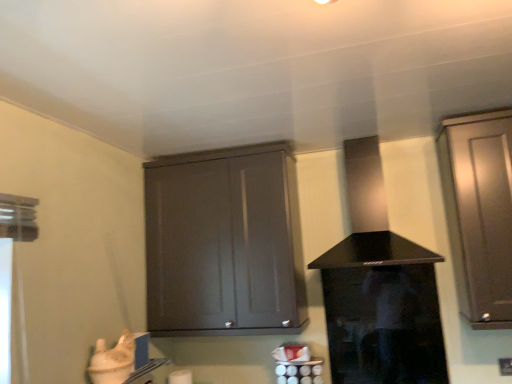
The width and height of the screenshot is (512, 384). In order to click on black glass vent at center in this screenshot , I will do `click(369, 217)`.

What do you see at coordinates (479, 212) in the screenshot?
I see `satin brown cabinet at right, the second cabinetry in the left-to-right sequence` at bounding box center [479, 212].

How much space does satin brown cabinet at right, the second cabinetry in the left-to-right sequence, occupy horizontally?

It is 37.26 centimeters.

Find the location of a particular element. This screenshot has height=384, width=512. matte gray cabinet at center, which appears as the first cabinetry when viewed from the left is located at coordinates pyautogui.click(x=223, y=242).

Find the location of a particular element. transparent glass screen door at center is located at coordinates 384,325.

What are the coordinates of `black glass vent at center` in the screenshot? It's located at (369, 217).

From a real-world perspective, is black glass vent at center positioned under matte gray cabinet at center, which appears as the first cabinetry when viewed from the left, based on gravity?

No, from a real-world perspective, black glass vent at center is not below matte gray cabinet at center, which appears as the first cabinetry when viewed from the left.

Can you confirm if black glass vent at center is positioned to the left of matte gray cabinet at center, the second cabinetry from the right?

In fact, black glass vent at center is to the right of matte gray cabinet at center, the second cabinetry from the right.

Which object is wider, black glass vent at center or matte gray cabinet at center, which appears as the first cabinetry when viewed from the left?

black glass vent at center is wider.

Could you measure the distance between black glass vent at center and matte gray cabinet at center, which appears as the first cabinetry when viewed from the left?

black glass vent at center and matte gray cabinet at center, which appears as the first cabinetry when viewed from the left, are 22.08 inches apart.

From a real-world perspective, is transparent glass screen door at center under satin brown cabinet at right, the second cabinetry in the left-to-right sequence?

Yes.

Looking at this image, looking at their sizes, would you say transparent glass screen door at center is wider or thinner than satin brown cabinet at right, the second cabinetry in the left-to-right sequence?

In the image, transparent glass screen door at center appears to be more narrow than satin brown cabinet at right, the second cabinetry in the left-to-right sequence.

Identify the location of screen door on the left of satin brown cabinet at right, the second cabinetry in the left-to-right sequence. (384, 325).

Would you say transparent glass screen door at center is outside satin brown cabinet at right, the second cabinetry in the left-to-right sequence?

transparent glass screen door at center is positioned outside satin brown cabinet at right, the second cabinetry in the left-to-right sequence.

Consider the image. Is satin brown cabinet at right, the second cabinetry in the left-to-right sequence, inside the boundaries of black glass vent at center, or outside?

satin brown cabinet at right, the second cabinetry in the left-to-right sequence, is located beyond the bounds of black glass vent at center.

Is satin brown cabinet at right, placed as the first cabinetry when sorted from right to left, placed right next to black glass vent at center?

There is a gap between satin brown cabinet at right, placed as the first cabinetry when sorted from right to left, and black glass vent at center.

Considering the sizes of objects satin brown cabinet at right, the second cabinetry in the left-to-right sequence, and black glass vent at center in the image provided, who is thinner, satin brown cabinet at right, the second cabinetry in the left-to-right sequence, or black glass vent at center?

Thinner between the two is satin brown cabinet at right, the second cabinetry in the left-to-right sequence.

From the image's perspective, is transparent glass screen door at center positioned above or below matte gray cabinet at center, the second cabinetry from the right?

transparent glass screen door at center is situated lower than matte gray cabinet at center, the second cabinetry from the right, in the image.

From a real-world perspective, is transparent glass screen door at center physically located above or below matte gray cabinet at center, which appears as the first cabinetry when viewed from the left?

transparent glass screen door at center is situated lower than matte gray cabinet at center, which appears as the first cabinetry when viewed from the left, in the real world.

Between transparent glass screen door at center and matte gray cabinet at center, the second cabinetry from the right, which one has more height?

matte gray cabinet at center, the second cabinetry from the right.

Is matte gray cabinet at center, which appears as the first cabinetry when viewed from the left, thinner than transparent glass screen door at center?

No.

Is transparent glass screen door at center located within matte gray cabinet at center, which appears as the first cabinetry when viewed from the left?

No, transparent glass screen door at center is not a part of matte gray cabinet at center, which appears as the first cabinetry when viewed from the left.

Considering the positions of objects matte gray cabinet at center, the second cabinetry from the right, and transparent glass screen door at center in the image provided, who is more to the right, matte gray cabinet at center, the second cabinetry from the right, or transparent glass screen door at center?

From the viewer's perspective, transparent glass screen door at center appears more on the right side.

From the picture: Between black glass vent at center and satin brown cabinet at right, the second cabinetry in the left-to-right sequence, which one has less height?

black glass vent at center is shorter.

Find the location of a particular element. cabinetry in front of the black glass vent at center is located at coordinates (479, 212).

From the image's perspective, is black glass vent at center above or below satin brown cabinet at right, the second cabinetry in the left-to-right sequence?

Clearly, from the image's perspective, black glass vent at center is above satin brown cabinet at right, the second cabinetry in the left-to-right sequence.

Is black glass vent at center bigger than satin brown cabinet at right, placed as the first cabinetry when sorted from right to left?

Indeed, black glass vent at center has a larger size compared to satin brown cabinet at right, placed as the first cabinetry when sorted from right to left.

Between point (369, 259) and point (425, 365), which one is positioned in front?

Positioned in front is point (369, 259).

The width and height of the screenshot is (512, 384). Identify the location of screen door below the black glass vent at center (from a real-world perspective). (384, 325).

From a real-world perspective, which is physically below, black glass vent at center or transparent glass screen door at center?

In real-world perspective, transparent glass screen door at center is lower.

Is transparent glass screen door at center inside black glass vent at center?

No, transparent glass screen door at center is not surrounded by black glass vent at center.

Find the location of a particular element. The height and width of the screenshot is (384, 512). the 2nd cabinetry below when counting from the black glass vent at center (from the image's perspective) is located at coordinates (223, 242).

Find the location of a particular element. This screenshot has width=512, height=384. screen door that is behind the satin brown cabinet at right, the second cabinetry in the left-to-right sequence is located at coordinates (384, 325).

Based on their spatial positions, is black glass vent at center or matte gray cabinet at center, which appears as the first cabinetry when viewed from the left, closer to transparent glass screen door at center?

black glass vent at center lies closer to transparent glass screen door at center than the other object.

When comparing their distances from black glass vent at center, does matte gray cabinet at center, which appears as the first cabinetry when viewed from the left, or satin brown cabinet at right, the second cabinetry in the left-to-right sequence, seem closer?

satin brown cabinet at right, the second cabinetry in the left-to-right sequence, lies closer to black glass vent at center than the other object.

From the image, which object appears to be farther from transparent glass screen door at center, satin brown cabinet at right, placed as the first cabinetry when sorted from right to left, or matte gray cabinet at center, the second cabinetry from the right?

matte gray cabinet at center, the second cabinetry from the right, is positioned further to the anchor transparent glass screen door at center.

When comparing their distances from satin brown cabinet at right, placed as the first cabinetry when sorted from right to left, does matte gray cabinet at center, which appears as the first cabinetry when viewed from the left, or transparent glass screen door at center seem closer?

Among the two, transparent glass screen door at center is located nearer to satin brown cabinet at right, placed as the first cabinetry when sorted from right to left.

Considering their positions, is satin brown cabinet at right, placed as the first cabinetry when sorted from right to left, positioned further to black glass vent at center than matte gray cabinet at center, which appears as the first cabinetry when viewed from the left?

matte gray cabinet at center, which appears as the first cabinetry when viewed from the left, is positioned further to the anchor black glass vent at center.

Looking at this image, which object lies further to the anchor point transparent glass screen door at center, matte gray cabinet at center, which appears as the first cabinetry when viewed from the left, or satin brown cabinet at right, placed as the first cabinetry when sorted from right to left?

matte gray cabinet at center, which appears as the first cabinetry when viewed from the left.

In the scene shown: Based on their spatial positions, is black glass vent at center or transparent glass screen door at center closer to matte gray cabinet at center, the second cabinetry from the right?

black glass vent at center.

Estimate the real-world distances between objects in this image. Which object is closer to transparent glass screen door at center, matte gray cabinet at center, which appears as the first cabinetry when viewed from the left, or black glass vent at center?

black glass vent at center.

You are a GUI agent. You are given a task and a screenshot of the screen. Output one action in this format:
    pyautogui.click(x=<x>, y=<y>)
    Task: Click on the vent between matte gray cabinet at center, the second cabinetry from the right, and transparent glass screen door at center from left to right
    
    Given the screenshot: What is the action you would take?
    pyautogui.click(x=369, y=217)

I want to click on vent between matte gray cabinet at center, which appears as the first cabinetry when viewed from the left, and satin brown cabinet at right, placed as the first cabinetry when sorted from right to left, so click(369, 217).

Find the location of a particular element. The width and height of the screenshot is (512, 384). screen door between matte gray cabinet at center, which appears as the first cabinetry when viewed from the left, and satin brown cabinet at right, the second cabinetry in the left-to-right sequence, in the horizontal direction is located at coordinates (384, 325).